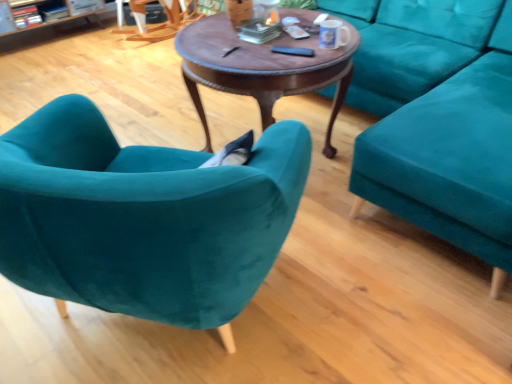
The image size is (512, 384). Identify the location of free space in front of black matte remote control at center, arranged as the first remote control when ordered from the bottom. coord(288,67).